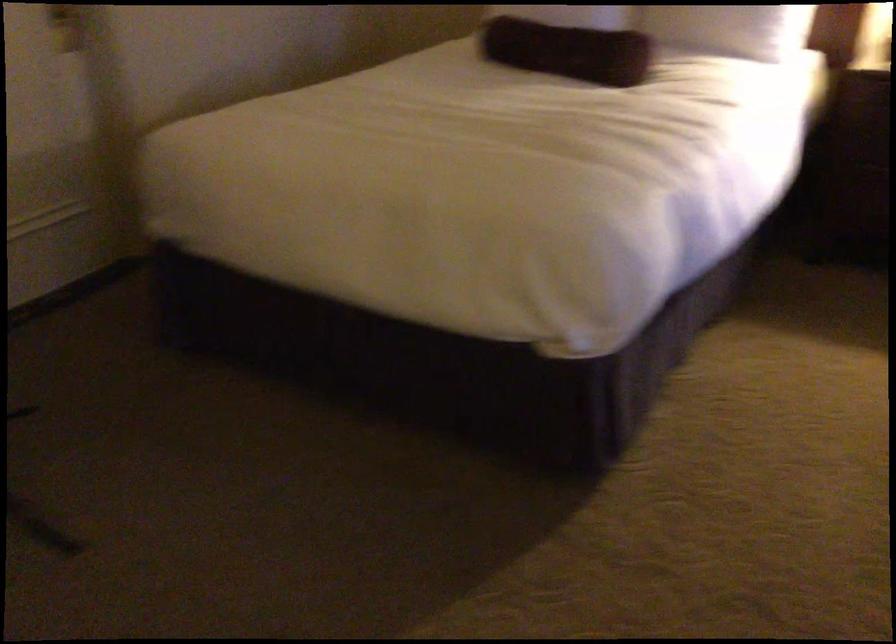
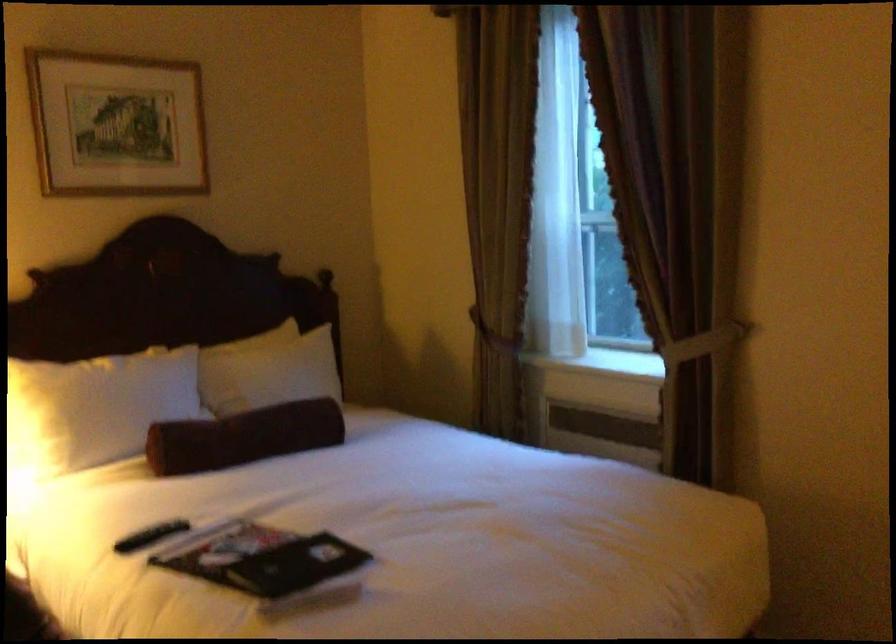
Question: The camera is either moving clockwise (left) or counter-clockwise (right) around the object. The first image is from the beginning of the video and the second image is from the end. Is the camera moving left or right when shooting the video?

Choices:
 (A) Left
 (B) Right

Answer: (A)